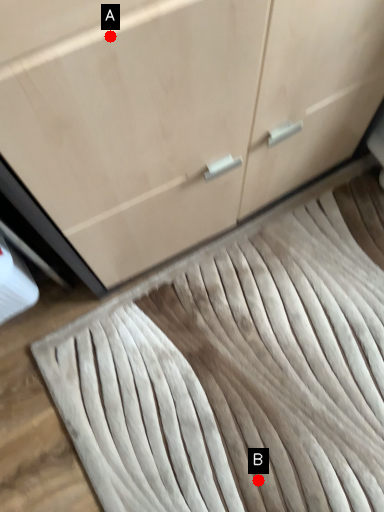
Question: Two points are circled on the image, labeled by A and B beside each circle. Which point is further to the camera?

Choices:
 (A) A is further
 (B) B is further

Answer: (B)